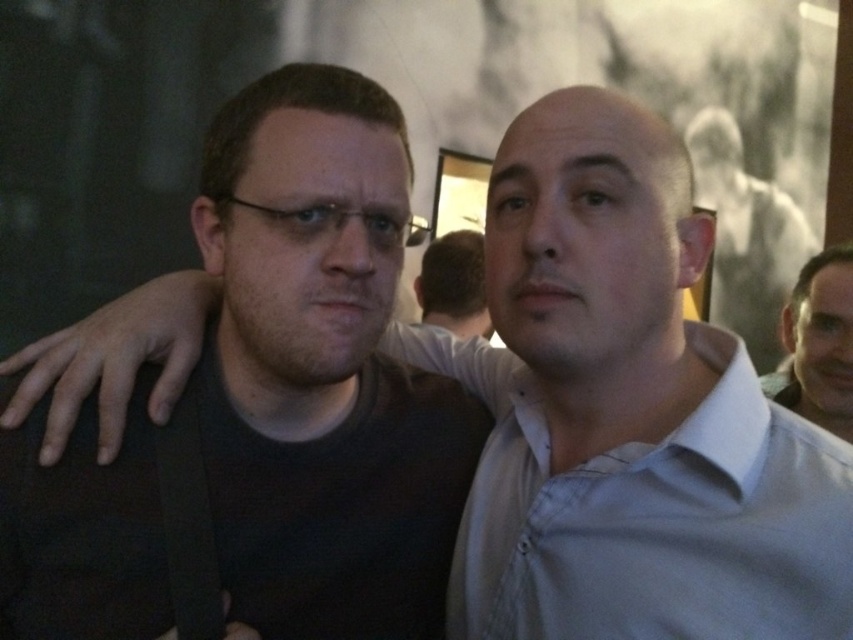
Does point (837, 412) come in front of point (454, 296)?

Yes, point (837, 412) is closer to viewer.

Identify the location of smooth skin face at right. [817, 342].

Which is in front, point (793, 381) or point (450, 236)?

Positioned in front is point (793, 381).

Where is `smooth skin face at right`? smooth skin face at right is located at coordinates (817, 342).